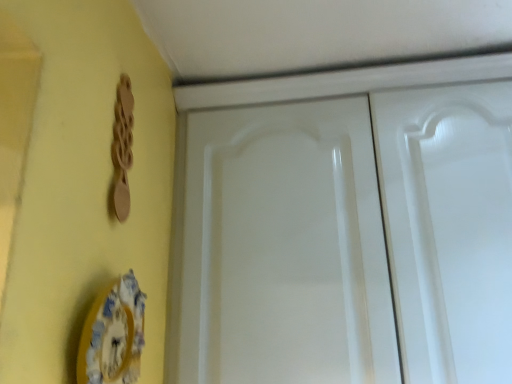
What is the approximate height of wooden spoon at upper left?

It is 31.81 centimeters.

Where is `porcelain plate at lower left`? This screenshot has width=512, height=384. porcelain plate at lower left is located at coordinates (113, 335).

Is white glossy cabinet doors at center positioned with its back to porcelain plate at lower left?

No.

From the image's perspective, is white glossy cabinet doors at center under porcelain plate at lower left?

No.

Is point (482, 62) behind point (90, 368)?

Yes, it is.

Can you confirm if white glossy cabinet doors at center is wider than porcelain plate at lower left?

Yes.

Is wooden spoon at upper left to the right of white glossy cabinet doors at center from the viewer's perspective?

No, wooden spoon at upper left is not to the right of white glossy cabinet doors at center.

Which of these two, wooden spoon at upper left or white glossy cabinet doors at center, stands shorter?

Standing shorter between the two is wooden spoon at upper left.

Is wooden spoon at upper left positioned with its back to white glossy cabinet doors at center?

No, wooden spoon at upper left is not facing away from white glossy cabinet doors at center.

Is point (115, 119) closer to camera compared to point (170, 322)?

Yes, point (115, 119) is in front of point (170, 322).

Based on the photo, is porcelain plate at lower left facing away from wooden spoon at upper left?

That's not correct — porcelain plate at lower left is not looking away from wooden spoon at upper left.

Is porcelain plate at lower left directly adjacent to wooden spoon at upper left?

No, porcelain plate at lower left is not next to wooden spoon at upper left.

Can you confirm if porcelain plate at lower left is positioned to the left of wooden spoon at upper left?

No, porcelain plate at lower left is not to the left of wooden spoon at upper left.

The width and height of the screenshot is (512, 384). In order to click on plate below the wooden spoon at upper left (from the image's perspective) in this screenshot , I will do `click(113, 335)`.

From a real-world perspective, which is physically below, white glossy cabinet doors at center or wooden spoon at upper left?

white glossy cabinet doors at center is physically lower.

Is white glossy cabinet doors at center thinner than wooden spoon at upper left?

In fact, white glossy cabinet doors at center might be wider than wooden spoon at upper left.

Based on the photo, is white glossy cabinet doors at center positioned behind wooden spoon at upper left?

Yes, the depth of white glossy cabinet doors at center is greater than that of wooden spoon at upper left.

From a real-world perspective, which is physically below, porcelain plate at lower left or white glossy cabinet doors at center?

porcelain plate at lower left is physically lower.

From the picture: From the image's perspective, which is below, porcelain plate at lower left or white glossy cabinet doors at center?

porcelain plate at lower left, from the image's perspective.

Is the position of porcelain plate at lower left less distant than that of white glossy cabinet doors at center?

Yes, it is.

Which object is further away from the camera, wooden spoon at upper left or porcelain plate at lower left?

wooden spoon at upper left is more distant.

Is wooden spoon at upper left far from porcelain plate at lower left?

wooden spoon at upper left is actually quite close to porcelain plate at lower left.

I want to click on plate lying on the right of wooden spoon at upper left, so click(x=113, y=335).

Is wooden spoon at upper left wider than porcelain plate at lower left?

No, wooden spoon at upper left is not wider than porcelain plate at lower left.

Where is `plate on the left side of white glossy cabinet doors at center`? This screenshot has width=512, height=384. plate on the left side of white glossy cabinet doors at center is located at coordinates (113, 335).

Locate an element on the screen. The image size is (512, 384). cabinetry on the right of wooden spoon at upper left is located at coordinates (372, 115).

In the scene shown: Estimate the real-world distances between objects in this image. Which object is further from white glossy cabinet doors at center, wooden spoon at upper left or porcelain plate at lower left?

porcelain plate at lower left is positioned further to the anchor white glossy cabinet doors at center.

From the image, which object appears to be farther from wooden spoon at upper left, porcelain plate at lower left or white glossy cabinet doors at center?

white glossy cabinet doors at center lies further to wooden spoon at upper left than the other object.

Considering their positions, is porcelain plate at lower left positioned closer to white glossy cabinet doors at center than wooden spoon at upper left?

wooden spoon at upper left is closer to white glossy cabinet doors at center.

Looking at the image, which one is located further to porcelain plate at lower left, wooden spoon at upper left or white glossy cabinet doors at center?

white glossy cabinet doors at center.

Considering their positions, is white glossy cabinet doors at center positioned closer to wooden spoon at upper left than porcelain plate at lower left?

porcelain plate at lower left.

Estimate the real-world distances between objects in this image. Which object is closer to porcelain plate at lower left, white glossy cabinet doors at center or wooden spoon at upper left?

Among the two, wooden spoon at upper left is located nearer to porcelain plate at lower left.

You are a GUI agent. You are given a task and a screenshot of the screen. Output one action in this format:
    pyautogui.click(x=<x>, y=<y>)
    Task: Click on the plate between wooden spoon at upper left and white glossy cabinet doors at center
    
    Given the screenshot: What is the action you would take?
    pyautogui.click(x=113, y=335)